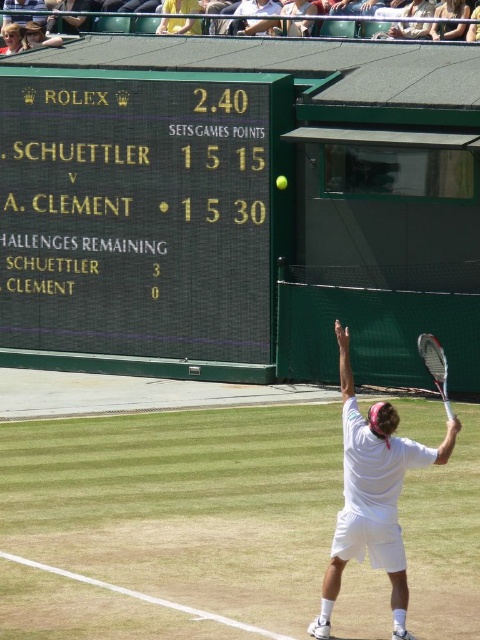
Question: Is white matte tennis racket at upper right smaller than matte black tennis racket at upper right?

Choices:
 (A) yes
 (B) no

Answer: (A)

Question: Estimate the real-world distances between objects in this image. Which object is closer to the yellow rubber tennis ball at center?

Choices:
 (A) matte black tennis racket at upper right
 (B) green matte scoreboard at upper left

Answer: (B)

Question: From the image, what is the correct spatial relationship of white matte tennis racket at upper right in relation to matte black tennis racket at upper right?

Choices:
 (A) above
 (B) below

Answer: (B)

Question: Does white matte tennis racket at upper right have a greater width compared to matte black tennis racket at upper right?

Choices:
 (A) no
 (B) yes

Answer: (A)

Question: Estimate the real-world distances between objects in this image. Which object is farther from the yellow rubber tennis ball at center?

Choices:
 (A) matte black tennis racket at upper right
 (B) green matte scoreboard at upper left

Answer: (A)

Question: Which point is closer to the camera?

Choices:
 (A) (433, 353)
 (B) (283, 182)
 (C) (336, 324)
 (D) (240, 234)

Answer: (A)